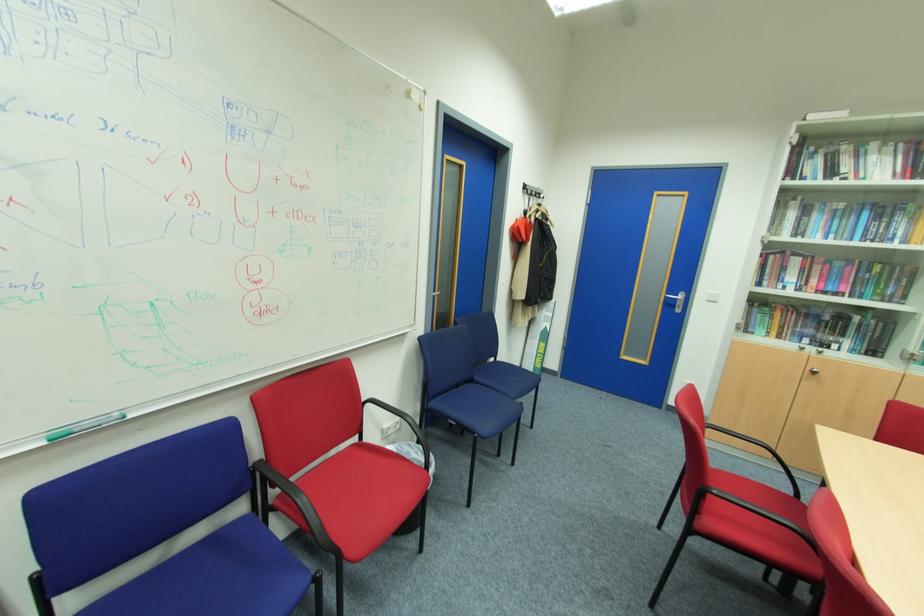
Find the location of a particular element. silver door handle is located at coordinates (675, 296).